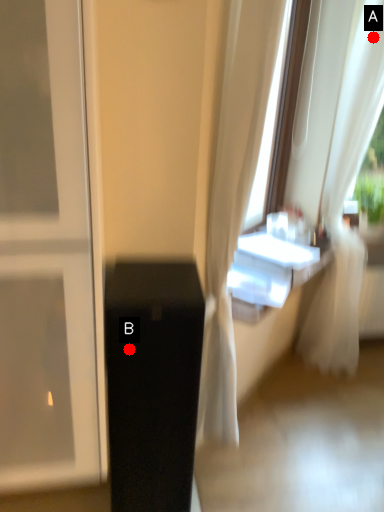
Question: Two points are circled on the image, labeled by A and B beside each circle. Among these points, which one is nearest to the camera?

Choices:
 (A) A is closer
 (B) B is closer

Answer: (B)